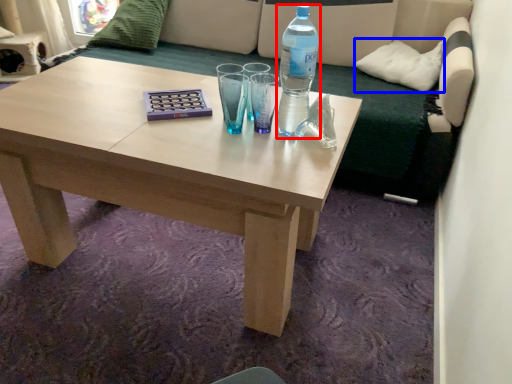
Question: Which object is closer to the camera taking this photo, bottle (highlighted by a red box) or pillow (highlighted by a blue box)?

Choices:
 (A) bottle
 (B) pillow

Answer: (A)